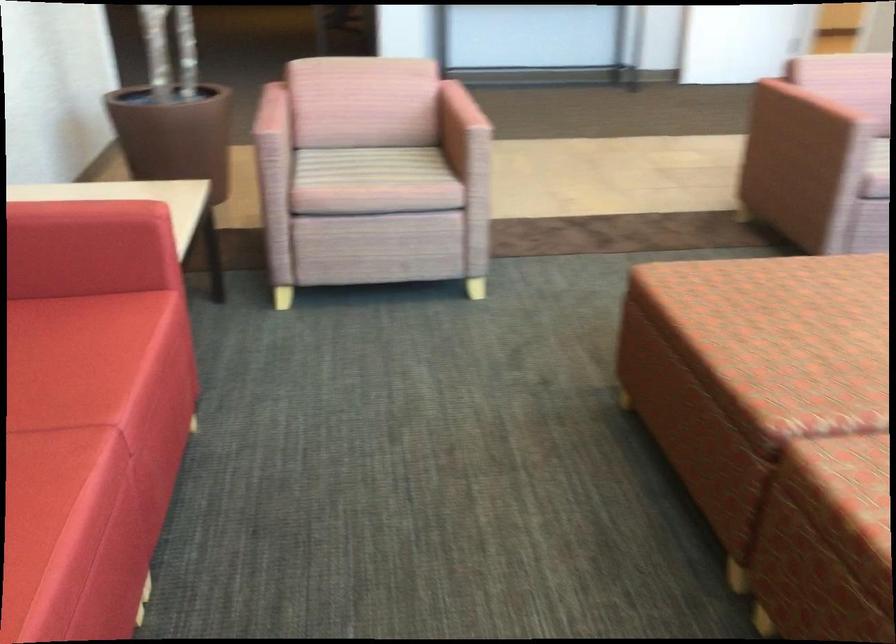
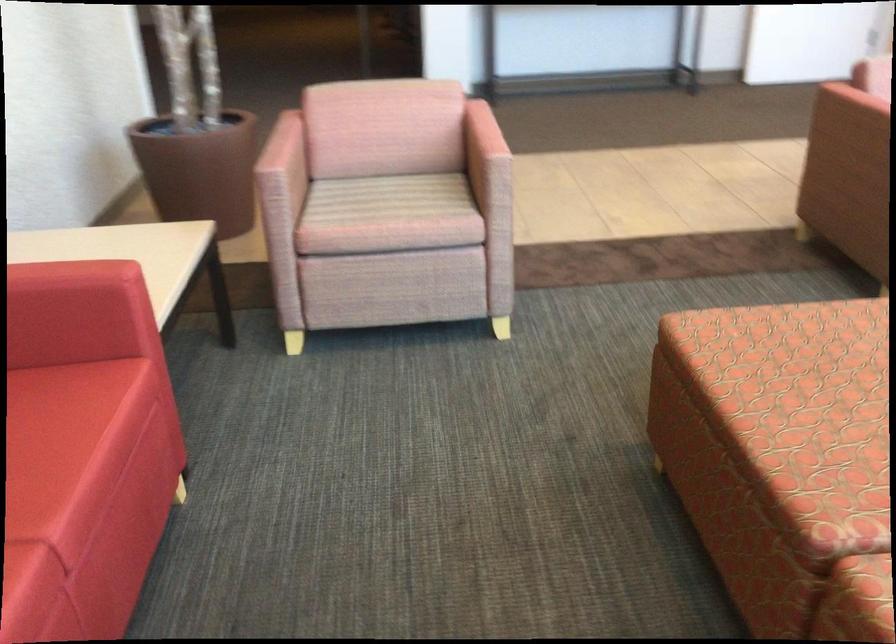
Where in the second image is the point corresponding to point (110, 207) from the first image?

(76, 272)